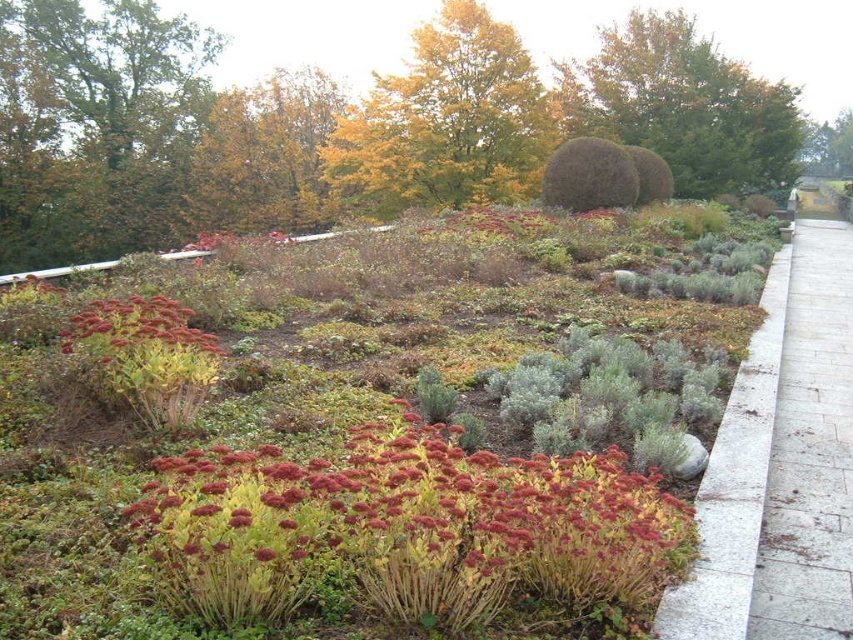
You are a gardener planning to install a new sprinkler system. You need to determine which object between the gray stone path at right and the green leafy tree at upper center requires more water. Based on their height, which one might need more water?

The green leafy tree at upper center is taller than the gray stone path at right, so it might need more water.

You are standing at the entrance of the garden and see the point marked at coordinates (810, 451). What does this point represent in the garden?

The point at (810, 451) represents the gray stone path at right.